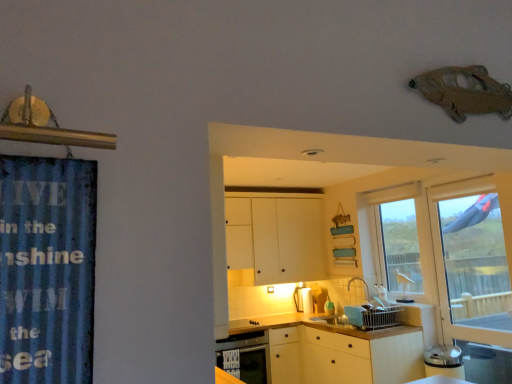
Question: In the image, is blue corrugated metal at left positioned in front of or behind white matte cabinet at center?

Choices:
 (A) front
 (B) behind

Answer: (A)

Question: Looking at their shapes, would you say blue corrugated metal at left is wider or thinner than white matte cabinet at center?

Choices:
 (A) thin
 (B) wide

Answer: (A)

Question: Which object is the farthest from the matte white dishwasher at lower center?

Choices:
 (A) blue corrugated metal at left
 (B) white matte counter top at lower center
 (C) matte white toaster at lower center, which is the second appliance from back to front
 (D) transparent glass door at right
 (E) clear glass window at center

Answer: (A)

Question: Which object is positioned farthest from the clear glass window at center?

Choices:
 (A) transparent glass door at right
 (B) white matte cabinet at center
 (C) matte white dishwasher at lower center
 (D) white glossy paper towel dispenser at center, the 1th appliance from the left
 (E) blue corrugated metal at left

Answer: (E)